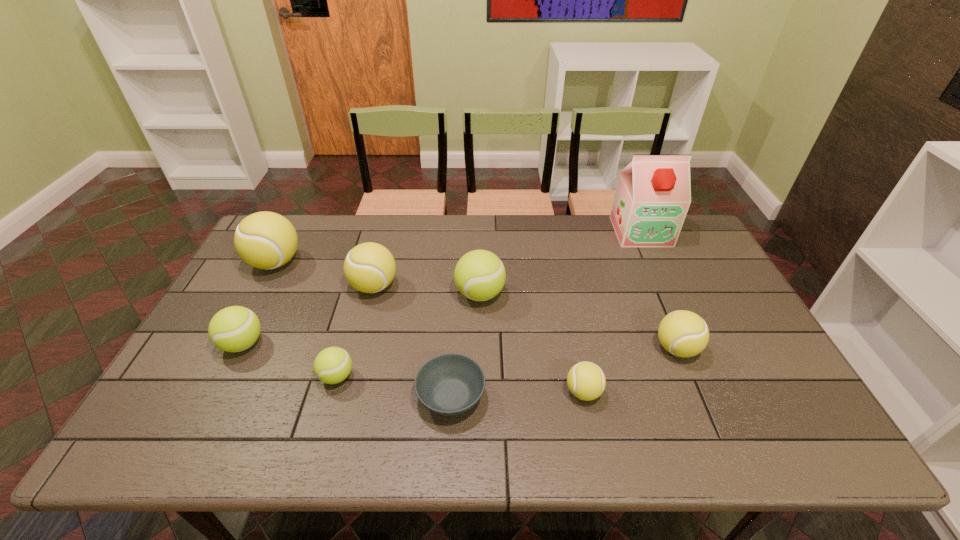
Image resolution: width=960 pixels, height=540 pixels. I want to click on soya milk, so click(x=653, y=194).

This screenshot has width=960, height=540. What are the coordinates of `the eighth shortest object` in the screenshot? It's located at (266, 240).

I want to click on the biggest yellow tennis ball, so click(x=266, y=240).

Where is `the third yellow tennis ball from right to left`? The image size is (960, 540). the third yellow tennis ball from right to left is located at coordinates (369, 267).

You are a GUI agent. You are given a task and a screenshot of the screen. Output one action in this format:
    pyautogui.click(x=<x>, y=<y>)
    Task: Click on the rightmost green tennis ball
    
    Given the screenshot: What is the action you would take?
    pyautogui.click(x=479, y=275)

Image resolution: width=960 pixels, height=540 pixels. I want to click on the third tennis ball from right to left, so (x=479, y=275).

You are a GUI agent. You are given a task and a screenshot of the screen. Output one action in this format:
    pyautogui.click(x=<x>, y=<y>)
    Task: Click on the second nearest yellow tennis ball
    
    Given the screenshot: What is the action you would take?
    pyautogui.click(x=683, y=333)

This screenshot has height=540, width=960. In order to click on the rightmost yellow tennis ball in this screenshot , I will do (683, 333).

Find the location of a particular element. This screenshot has height=540, width=960. the leftmost green tennis ball is located at coordinates (233, 329).

Where is `the smallest green tennis ball`? the smallest green tennis ball is located at coordinates (332, 365).